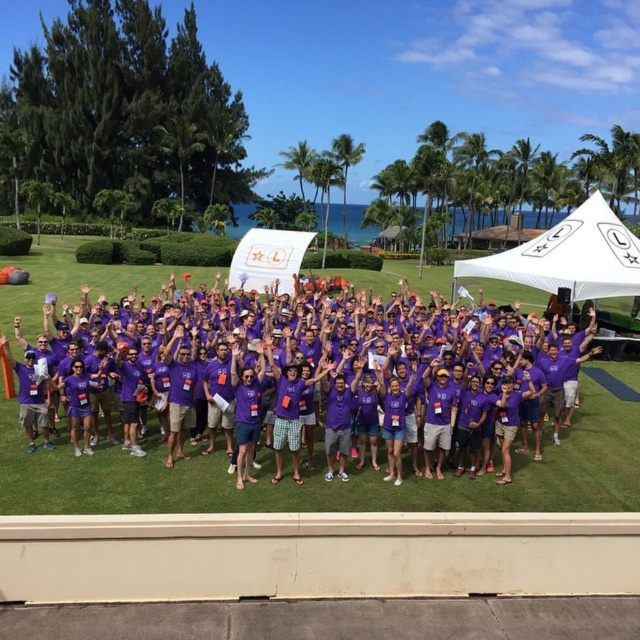
Is purple cotton shirt at center smaller than white fabric canopy at center?

No, purple cotton shirt at center is not smaller than white fabric canopy at center.

Which is in front, point (208, 305) or point (552, 291)?

Point (208, 305)

This screenshot has height=640, width=640. In order to click on purple cotton shirt at center in this screenshot , I will do `click(316, 378)`.